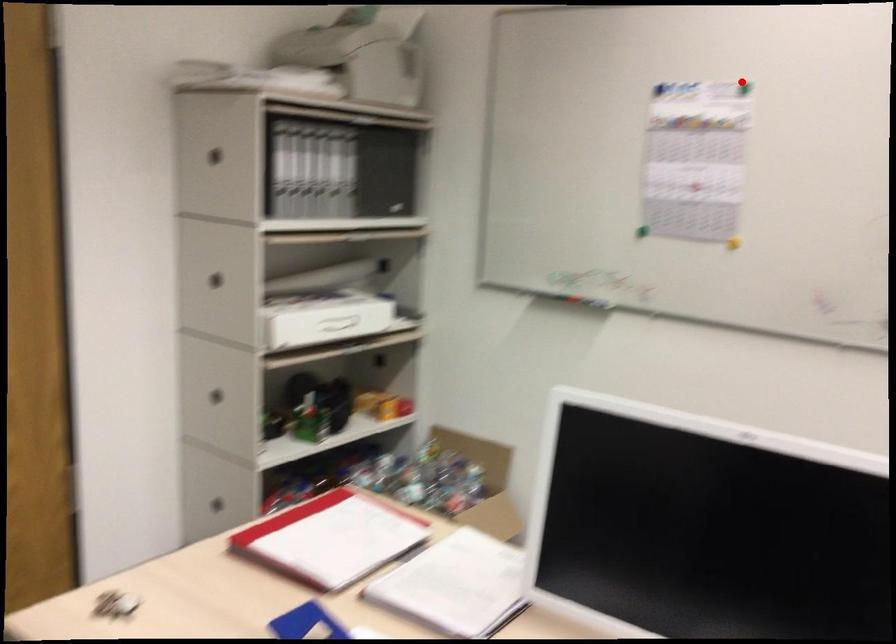
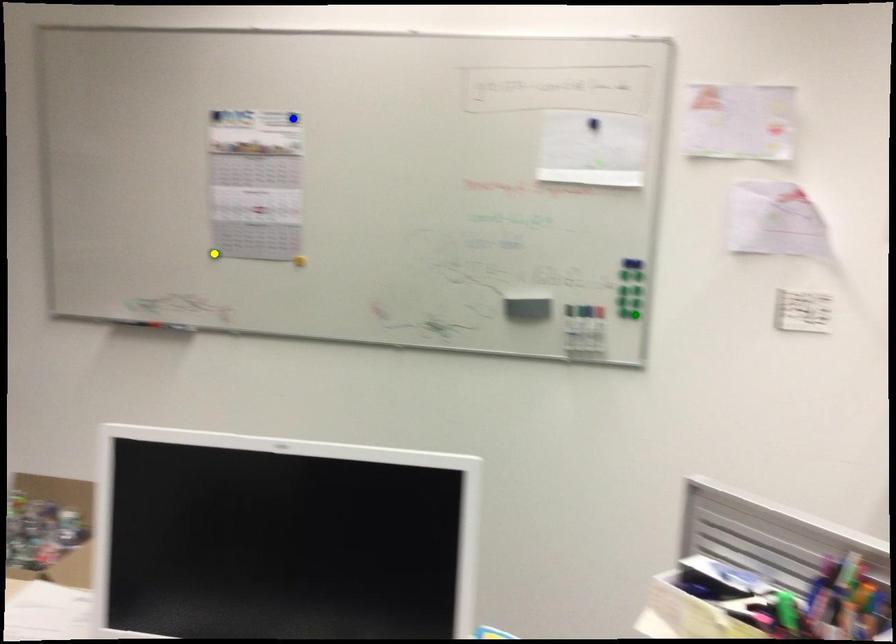
Question: I am providing you with two images of the same scene from different viewpoints. A red point is marked on the first image. You are given multiple points on the second image. Which spot in image 2 lines up with the point in image 1?

Choices:
 (A) green point
 (B) yellow point
 (C) blue point

Answer: (C)